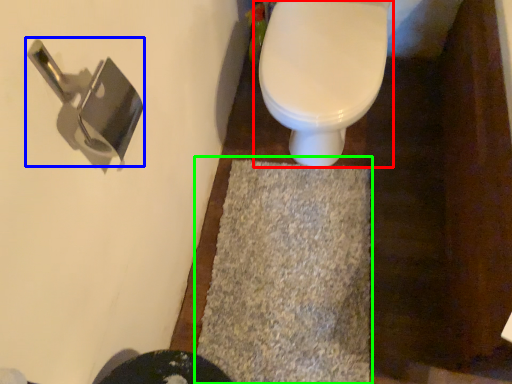
Question: Based on their relative distances, which object is nearer to toilet (highlighted by a red box)? Choose from door handle (highlighted by a blue box) and bath mat (highlighted by a green box).

Choices:
 (A) door handle
 (B) bath mat

Answer: (B)